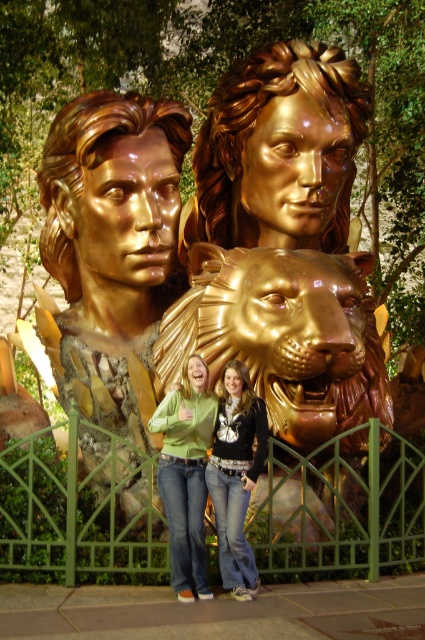
Question: Observing the image, what is the correct spatial positioning of shiny gold bust at center in reference to jeans at center?

Choices:
 (A) right
 (B) left

Answer: (B)

Question: Observing the image, what is the correct spatial positioning of gold polished statue at center in reference to shiny gold bust at center?

Choices:
 (A) left
 (B) right

Answer: (B)

Question: Can you confirm if shiny gold bust at center is smaller than jeans at center?

Choices:
 (A) no
 (B) yes

Answer: (A)

Question: Which point is closer to the camera?

Choices:
 (A) jeans at center
 (B) gold polished statue at center

Answer: (A)

Question: Among these objects, which one is farthest from the camera?

Choices:
 (A) shiny gold bust at center
 (B) jeans at center
 (C) gold shiny lion at center

Answer: (C)

Question: Which of the following is the closest to the observer?

Choices:
 (A) gold polished statue at center
 (B) gold shiny lion at center
 (C) jeans at center
 (D) shiny gold bust at center

Answer: (C)